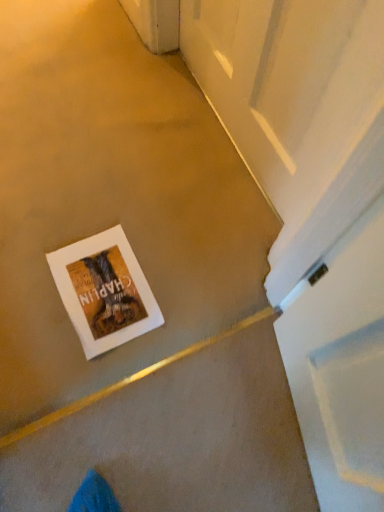
Question: Considering the relative sizes of white paper postcard at center and white glossy screen door at upper right in the image provided, is white paper postcard at center bigger than white glossy screen door at upper right?

Choices:
 (A) yes
 (B) no

Answer: (B)

Question: Is white paper postcard at center thinner than white glossy screen door at upper right?

Choices:
 (A) no
 (B) yes

Answer: (A)

Question: Is white paper postcard at center at the left side of white glossy screen door at upper right?

Choices:
 (A) no
 (B) yes

Answer: (B)

Question: Is white paper postcard at center looking in the opposite direction of white glossy screen door at upper right?

Choices:
 (A) no
 (B) yes

Answer: (A)

Question: Considering the relative sizes of white paper postcard at center and white glossy screen door at upper right in the image provided, is white paper postcard at center shorter than white glossy screen door at upper right?

Choices:
 (A) no
 (B) yes

Answer: (B)

Question: Considering the relative sizes of white paper postcard at center and white glossy screen door at upper right in the image provided, is white paper postcard at center smaller than white glossy screen door at upper right?

Choices:
 (A) no
 (B) yes

Answer: (B)

Question: Is white paper postcard at center at the back of white glossy screen door at upper right?

Choices:
 (A) yes
 (B) no

Answer: (B)

Question: Does white glossy screen door at upper right lie in front of white paper postcard at center?

Choices:
 (A) no
 (B) yes

Answer: (B)

Question: Is white glossy screen door at upper right to the left of white paper postcard at center from the viewer's perspective?

Choices:
 (A) no
 (B) yes

Answer: (A)

Question: Considering the relative sizes of white glossy screen door at upper right and white paper postcard at center in the image provided, is white glossy screen door at upper right smaller than white paper postcard at center?

Choices:
 (A) no
 (B) yes

Answer: (A)

Question: From a real-world perspective, is white glossy screen door at upper right on white paper postcard at center?

Choices:
 (A) no
 (B) yes

Answer: (B)

Question: Is white glossy screen door at upper right further to the viewer compared to white paper postcard at center?

Choices:
 (A) yes
 (B) no

Answer: (B)

Question: From the image's perspective, is white glossy screen door at upper right located above or below white paper postcard at center?

Choices:
 (A) above
 (B) below

Answer: (A)